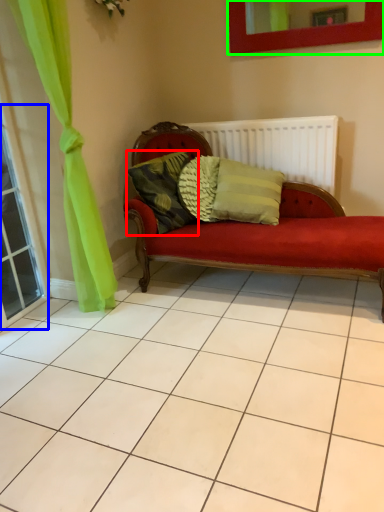
Question: Which object is the closest to the pillow (highlighted by a red box)? Choose among these: window (highlighted by a blue box) or picture frame (highlighted by a green box).

Choices:
 (A) window
 (B) picture frame

Answer: (A)